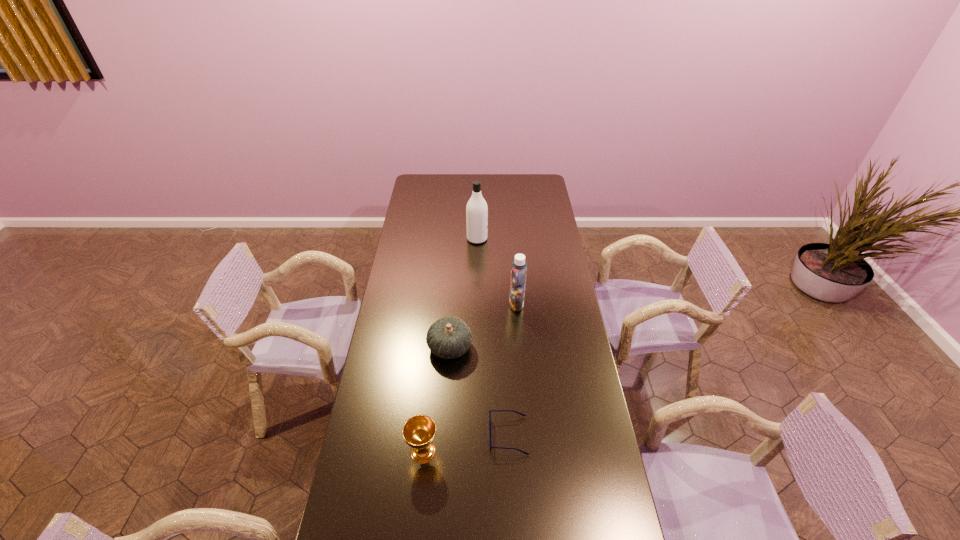
Where is `empty location between the left shampoo and the second farthest object`? empty location between the left shampoo and the second farthest object is located at coordinates (496, 271).

Identify the location of unoccupied area between the shorter shampoo and the spectacles. Image resolution: width=960 pixels, height=540 pixels. (513, 369).

Where is `vacant space that's between the spectacles and the left shampoo`? vacant space that's between the spectacles and the left shampoo is located at coordinates (492, 337).

Find the location of a particular element. This screenshot has width=960, height=540. free space between the third farthest object and the right shampoo is located at coordinates (483, 326).

Find the location of a particular element. free area in between the spectacles and the farther shampoo is located at coordinates (492, 337).

The width and height of the screenshot is (960, 540). Identify the location of vacant area that lies between the left shampoo and the fourth shortest object. (496, 271).

Where is `free spot between the fourth shortest object and the gourd`? This screenshot has width=960, height=540. free spot between the fourth shortest object and the gourd is located at coordinates (483, 326).

I want to click on vacant space in between the tallest object and the nearer shampoo, so click(x=496, y=271).

The image size is (960, 540). In order to click on vacant space that is in between the gourd and the chalice in this screenshot , I will do `click(437, 400)`.

The height and width of the screenshot is (540, 960). Find the location of `object that is the third closest to the chalice`. object that is the third closest to the chalice is located at coordinates (518, 267).